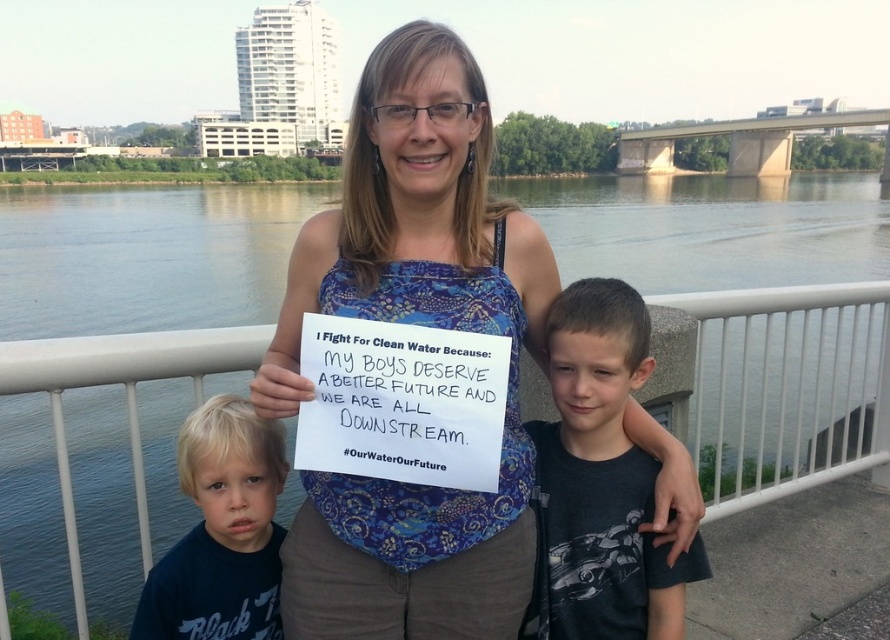
Question: Which object appears farthest from the camera in this image?

Choices:
 (A) blue patterned tank top at center
 (B) green water at center
 (C) dark gray t-shirt at right
 (D) dark blue t-shirt at lower left

Answer: (B)

Question: Estimate the real-world distances between objects in this image. Which object is closer to the blue patterned tank top at center?

Choices:
 (A) dark blue t-shirt at lower left
 (B) dark gray t-shirt at right
 (C) green water at center

Answer: (B)

Question: Does green water at center appear on the right side of blue patterned tank top at center?

Choices:
 (A) yes
 (B) no

Answer: (B)

Question: Is blue patterned tank top at center to the left of dark blue t-shirt at lower left from the viewer's perspective?

Choices:
 (A) no
 (B) yes

Answer: (A)

Question: Is green water at center below blue patterned tank top at center?

Choices:
 (A) no
 (B) yes

Answer: (A)

Question: Which object appears farthest from the camera in this image?

Choices:
 (A) blue patterned tank top at center
 (B) dark gray t-shirt at right

Answer: (B)